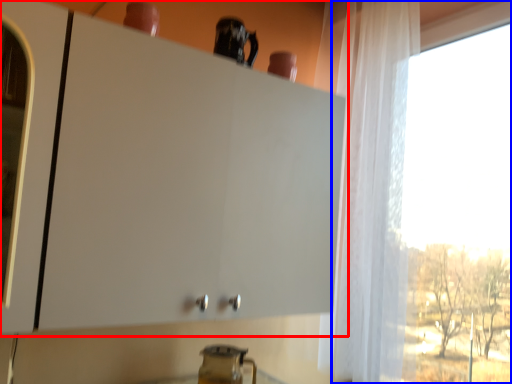
Question: Which object appears closest to the camera in this image, cabinetry (highlighted by a red box) or window (highlighted by a blue box)?

Choices:
 (A) cabinetry
 (B) window

Answer: (A)